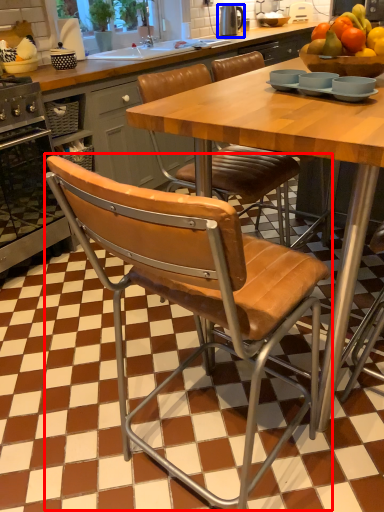
Question: Which point is closer to the camera, chair (highlighted by a red box) or appliance (highlighted by a blue box)?

Choices:
 (A) chair
 (B) appliance

Answer: (A)